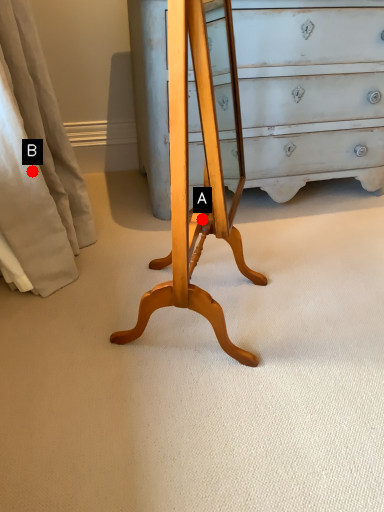
Question: Two points are circled on the image, labeled by A and B beside each circle. Which point is further to the camera?

Choices:
 (A) A is further
 (B) B is further

Answer: (B)